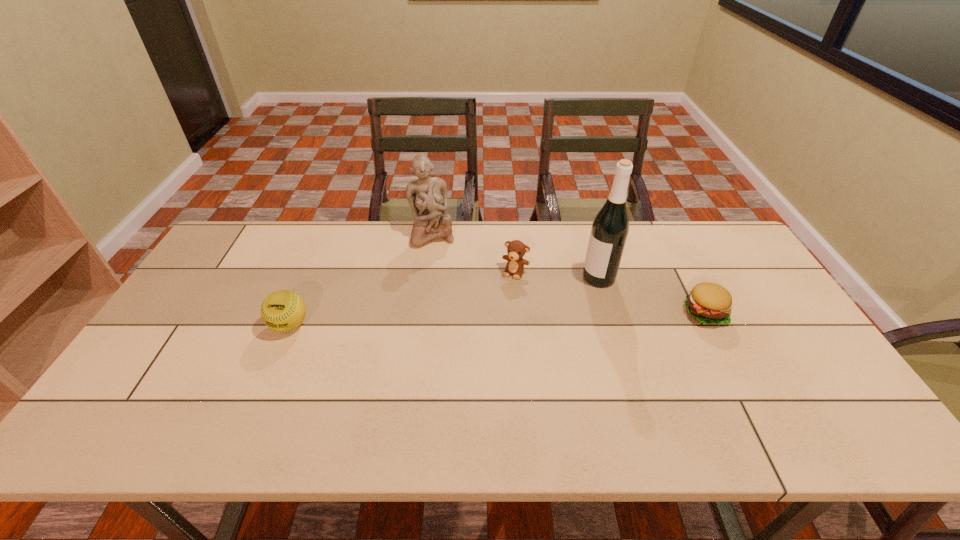
This screenshot has height=540, width=960. I want to click on the leftmost object, so click(x=283, y=310).

You are a GUI agent. You are given a task and a screenshot of the screen. Output one action in this format:
    pyautogui.click(x=<x>, y=<y>)
    Task: Click on the hamburger
    This screenshot has height=540, width=960.
    Given the screenshot: What is the action you would take?
    pyautogui.click(x=709, y=303)

Where is `the shortest object`? This screenshot has width=960, height=540. the shortest object is located at coordinates (709, 303).

The image size is (960, 540). I want to click on the third object from right to left, so click(x=516, y=249).

At what (x,y) coordinates should I click in order to perform the action: click on wine bottle. Please return your answer as a coordinate pair (x, y). The image size is (960, 540). Looking at the image, I should click on (610, 228).

Where is `the second object from right to left`? The height and width of the screenshot is (540, 960). the second object from right to left is located at coordinates (610, 228).

Image resolution: width=960 pixels, height=540 pixels. I want to click on the fourth shortest object, so click(x=427, y=196).

This screenshot has width=960, height=540. What are the coordinates of `figurine` in the screenshot? It's located at (427, 196).

Locate an element on the screen. The image size is (960, 540). blank space located 0.150m on the logo side of the softball is located at coordinates (263, 388).

Where is `vacant space located 0.380m on the left of the hamburger`? The height and width of the screenshot is (540, 960). vacant space located 0.380m on the left of the hamburger is located at coordinates (550, 313).